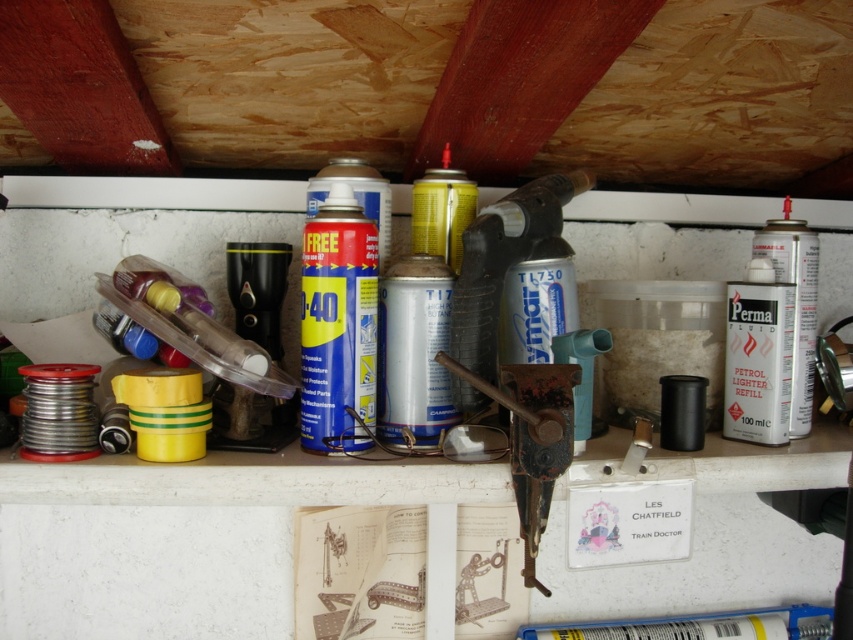
Question: Which point is closer to the camera?

Choices:
 (A) (804, 362)
 (B) (403, 349)
 (C) (427, 198)

Answer: (B)

Question: Estimate the real-world distances between objects in this image. Which object is closer to the white matte canister at right?

Choices:
 (A) blue metallic spray can at center
 (B) silver metallic spray can at center
 (C) yellow matte spray can at center

Answer: (C)

Question: Can you confirm if silver metallic spray can at center is positioned above white matte canister at right?

Choices:
 (A) no
 (B) yes

Answer: (A)

Question: Considering the relative positions of blue metallic spray can at center and white matte canister at right in the image provided, where is blue metallic spray can at center located with respect to white matte canister at right?

Choices:
 (A) above
 (B) below

Answer: (B)

Question: Can you confirm if silver metallic spray can at center is positioned above yellow matte spray can at center?

Choices:
 (A) yes
 (B) no

Answer: (B)

Question: Which object is farther from the camera taking this photo?

Choices:
 (A) yellow matte spray can at center
 (B) silver metallic spray can at center

Answer: (A)